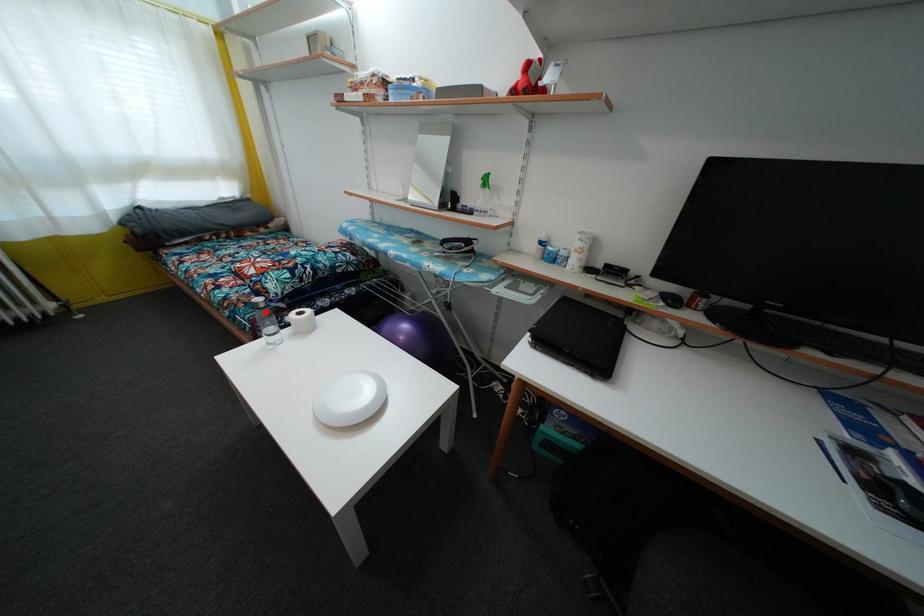
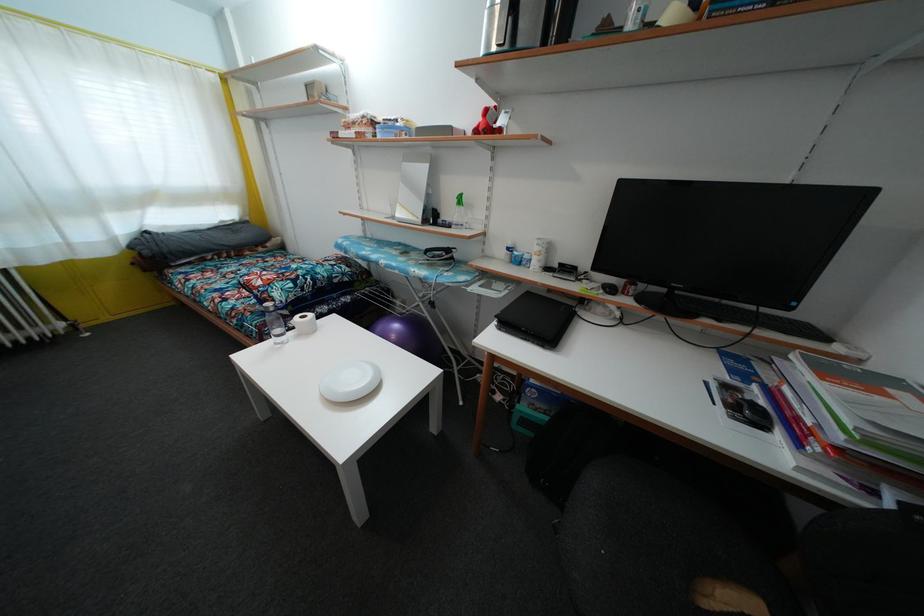
Question: I am providing you with two images of the same scene from different viewpoints. Given a red point in image1, look at the same physical point in image2. Is it:

Choices:
 (A) Closer to the viewpoint
 (B) Farther from the viewpoint

Answer: (B)